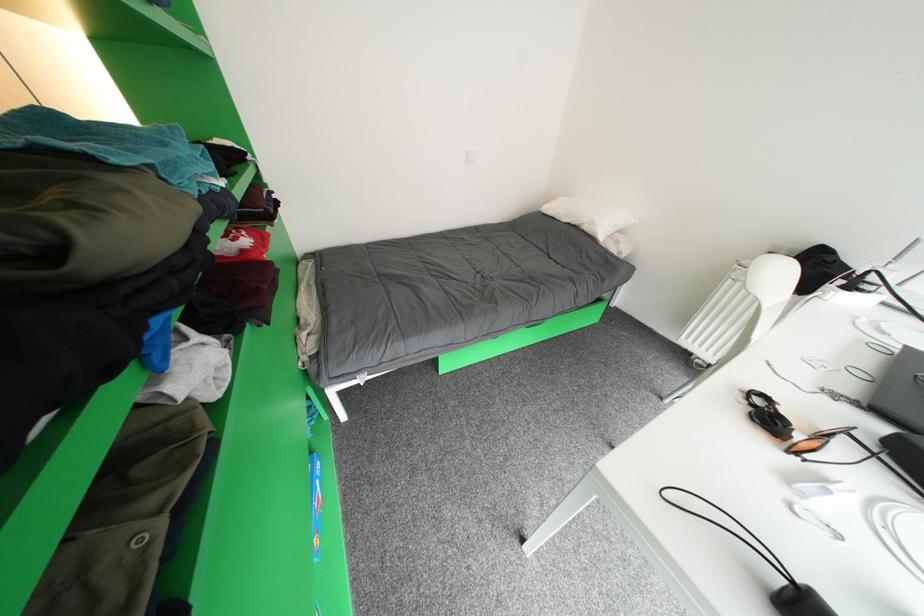
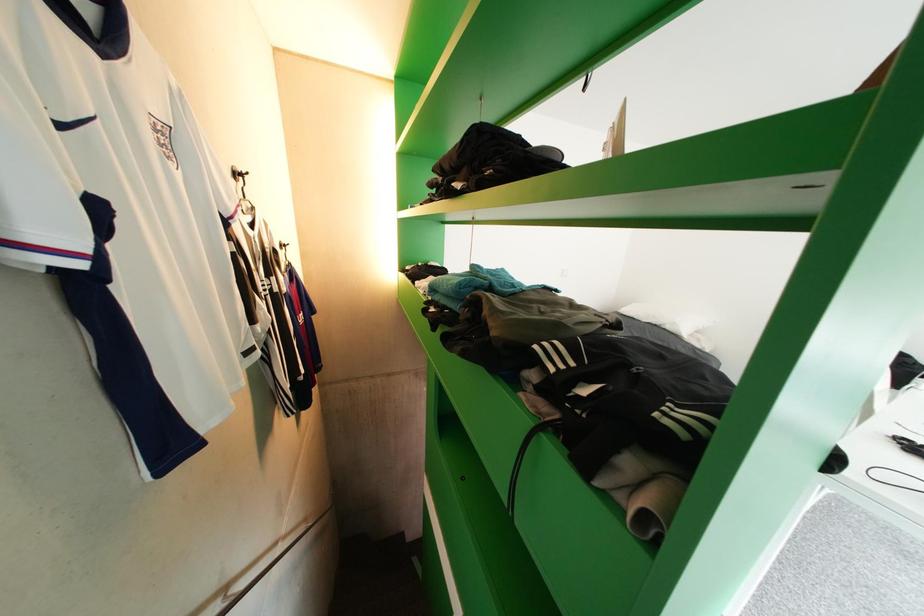
Which direction would the cameraman need to move to produce the second image?

The cameraman moved toward left, backward.